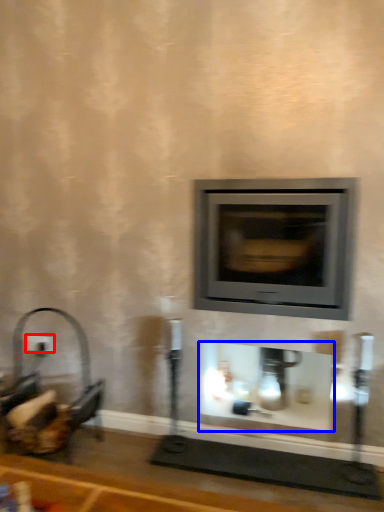
Question: Which object is further to the camera taking this photo, electric outlet (highlighted by a red box) or fireplace (highlighted by a blue box)?

Choices:
 (A) electric outlet
 (B) fireplace

Answer: (A)